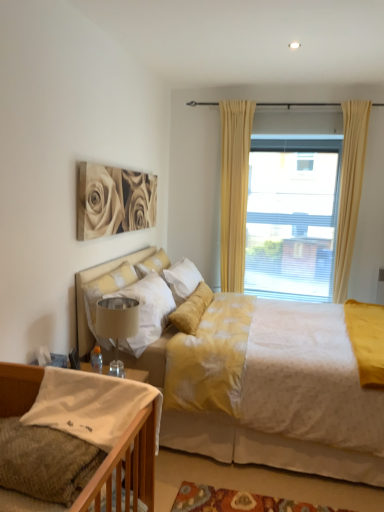
Question: Considering the positions of point (147, 259) and point (334, 280), is point (147, 259) closer or farther from the camera than point (334, 280)?

Choices:
 (A) closer
 (B) farther

Answer: (A)

Question: In the image, is soft white pillow at center, which is the 1th pillow in top-to-bottom order, on the left side or the right side of beige fabric curtain at upper right, the 1th curtain in the right-to-left sequence?

Choices:
 (A) left
 (B) right

Answer: (A)

Question: Which of these objects is positioned closest to the white textured bed at center, marked as the first bed in a back-to-front arrangement?

Choices:
 (A) matte beige roses at upper left
 (B) knitted fabric bed at lower left, the 1th bed when ordered from front to back
 (C) beige fabric lampshade at lower center
 (D) soft white pillow at center, the third pillow from the front
 (E) translucent glass window at upper center

Answer: (C)

Question: Estimate the real-world distances between objects in this image. Which object is farther from the translucent glass window at upper center?

Choices:
 (A) white soft pillow at upper left, the 2th pillow from the top
 (B) yellow fabric curtain at upper center, the 2th curtain positioned from the right
 (C) matte beige roses at upper left
 (D) white cotton pillow at lower left, the 3th pillow in the back-to-front sequence
 (E) beige fabric curtain at upper right, placed as the second curtain when sorted from left to right

Answer: (D)